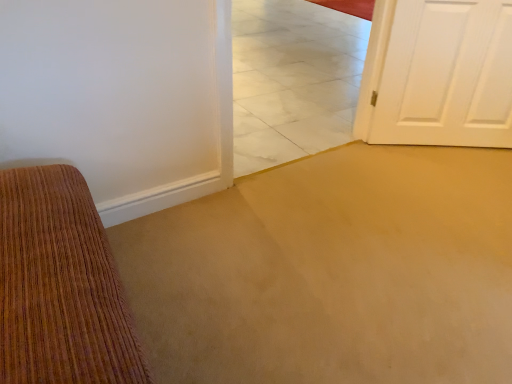
I want to click on white painted wood door at right, so click(x=438, y=74).

Describe the element at coordinates (438, 74) in the screenshot. I see `white painted wood door at right` at that location.

Measure the distance between point (362, 128) and camera.

Point (362, 128) is 7.65 feet from camera.

This screenshot has height=384, width=512. What do you see at coordinates (293, 80) in the screenshot? I see `white marble tile at center` at bounding box center [293, 80].

What are the coordinates of `white marble tile at center` in the screenshot? It's located at (293, 80).

In order to face white marble tile at center, should I rotate leftwards or rightwards?

It's best to rotate right around 7.660 degrees.

You are a GUI agent. You are given a task and a screenshot of the screen. Output one action in this format:
    pyautogui.click(x=<x>, y=<y>)
    Task: Click on the white painted wood door at right
    This screenshot has width=512, height=384.
    Given the screenshot: What is the action you would take?
    pyautogui.click(x=438, y=74)

Is white painted wood door at right to the right of white marble tile at center from the viewer's perspective?

Correct, you'll find white painted wood door at right to the right of white marble tile at center.

In the scene shown: Is white painted wood door at right in front of white marble tile at center?

No.

Considering the points (386, 49) and (316, 127), which point is in front, point (386, 49) or point (316, 127)?

The point (386, 49) is closer.

From the image's perspective, is white painted wood door at right above or below white marble tile at center?

white painted wood door at right is situated higher than white marble tile at center in the image.

From a real-world perspective, does white painted wood door at right stand above white marble tile at center?

No, from a real-world perspective, white painted wood door at right is not over white marble tile at center

In the scene shown: Is white painted wood door at right thinner than white marble tile at center?

Correct, the width of white painted wood door at right is less than that of white marble tile at center.

Considering the relative sizes of white painted wood door at right and white marble tile at center in the image provided, is white painted wood door at right taller than white marble tile at center?

In fact, white painted wood door at right may be shorter than white marble tile at center.

Considering the relative sizes of white painted wood door at right and white marble tile at center in the image provided, is white painted wood door at right smaller than white marble tile at center?

Yes.

Would you say white painted wood door at right is inside or outside white marble tile at center?

white painted wood door at right is spatially situated outside white marble tile at center.

Are white painted wood door at right and white marble tile at center beside each other?

No, white painted wood door at right is not touching white marble tile at center.

Is white painted wood door at right positioned with its back to white marble tile at center?

No, white painted wood door at right is not facing the opposite direction of white marble tile at center.

Can you tell me how much white painted wood door at right and white marble tile at center differ in facing direction?

The angle between the facing direction of white painted wood door at right and the facing direction of white marble tile at center is 32.9 degrees.

How far apart are white painted wood door at right and white marble tile at center?

white painted wood door at right is 34.83 inches from white marble tile at center.

Image resolution: width=512 pixels, height=384 pixels. In order to click on door that is above the white marble tile at center (from the image's perspective) in this screenshot , I will do `click(438, 74)`.

Is white marble tile at center to the left of white painted wood door at right from the viewer's perspective?

Indeed, white marble tile at center is positioned on the left side of white painted wood door at right.

Does white marble tile at center come in front of white painted wood door at right?

Yes.

Which is more distant, [248,99] or [423,142]?

Point [248,99]

From the image's perspective, who appears lower, white marble tile at center or white painted wood door at right?

white marble tile at center appears lower in the image.

From a real-world perspective, is white marble tile at center positioned above or below white painted wood door at right?

In terms of real-world spatial position, white marble tile at center is above white painted wood door at right.

In the scene shown: Looking at their sizes, would you say white marble tile at center is wider or thinner than white painted wood door at right?

white marble tile at center is wider than white painted wood door at right.

Can you confirm if white marble tile at center is shorter than white painted wood door at right?

In fact, white marble tile at center may be taller than white painted wood door at right.

Considering the relative sizes of white marble tile at center and white painted wood door at right in the image provided, is white marble tile at center smaller than white painted wood door at right?

Actually, white marble tile at center might be larger than white painted wood door at right.

Choose the correct answer: Is white marble tile at center inside white painted wood door at right or outside it?

white marble tile at center is not enclosed by white painted wood door at right.

Is white marble tile at center next to white painted wood door at right?

No.

Does white marble tile at center turn towards white painted wood door at right?

No.

What's the angular difference between white marble tile at center and white painted wood door at right's facing directions?

The facing directions of white marble tile at center and white painted wood door at right are 32.9 degrees apart.

Locate an element on the screen. door below the white marble tile at center (from a real-world perspective) is located at coordinates (438, 74).

Locate an element on the screen. tile above the white painted wood door at right (from a real-world perspective) is located at coordinates (293, 80).

Identify the location of door behind the white marble tile at center. The image size is (512, 384). (438, 74).